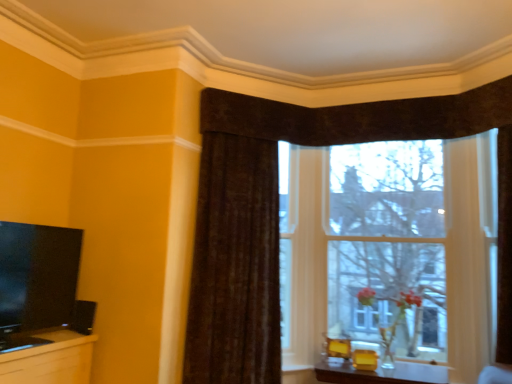
Question: In terms of height, does matte yellow table at lower center look taller or shorter compared to brown textured curtain at upper center?

Choices:
 (A) tall
 (B) short

Answer: (B)

Question: In the image, is matte yellow table at lower center positioned in front of or behind brown textured curtain at upper center?

Choices:
 (A) front
 (B) behind

Answer: (A)

Question: Which is nearer to the matte yellow table at lower center?

Choices:
 (A) transparent glass window at center
 (B) brown textured curtain at upper center
 (C) matte black tv at left

Answer: (A)

Question: Which of these objects is positioned closest to the transparent glass window at center?

Choices:
 (A) matte black tv at left
 (B) matte yellow table at lower center
 (C) brown textured curtain at upper center

Answer: (C)